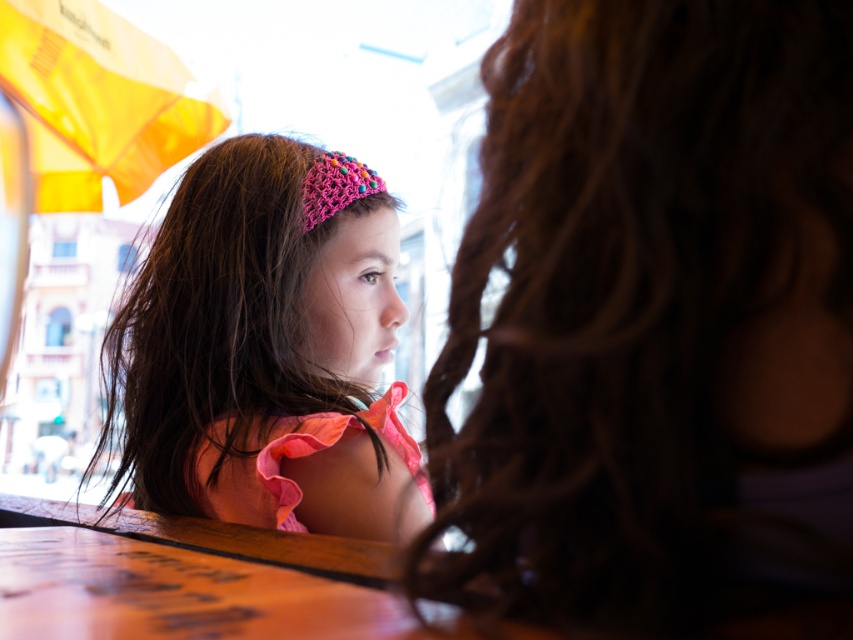
Is pink crochet headband at center to the right of pink knitted headband at upper center from the viewer's perspective?

In fact, pink crochet headband at center is to the left of pink knitted headband at upper center.

Who is shorter, pink crochet headband at center or pink knitted headband at upper center?

With less height is pink knitted headband at upper center.

Locate an element on the screen. This screenshot has width=853, height=640. pink crochet headband at center is located at coordinates (263, 349).

Who is more forward, (613, 401) or (231, 556)?

Point (613, 401) is more forward.

Does dark brown curly hair at upper right appear on the right side of wooden table at lower center?

Yes, dark brown curly hair at upper right is to the right of wooden table at lower center.

Which is in front, point (492, 148) or point (325, 540)?

Point (492, 148) is more forward.

You are a GUI agent. You are given a task and a screenshot of the screen. Output one action in this format:
    pyautogui.click(x=<x>, y=<y>)
    Task: Click on the dark brown curly hair at upper right
    
    Given the screenshot: What is the action you would take?
    pyautogui.click(x=653, y=321)

Is wooden table at lower center smaller than pink knitted headband at upper center?

No.

Between point (33, 566) and point (305, 224), which one is positioned in front?

Point (33, 566)

Where is `wooden table at lower center`? Image resolution: width=853 pixels, height=640 pixels. wooden table at lower center is located at coordinates click(187, 579).

Locate an element on the screen. wooden table at lower center is located at coordinates coord(187,579).